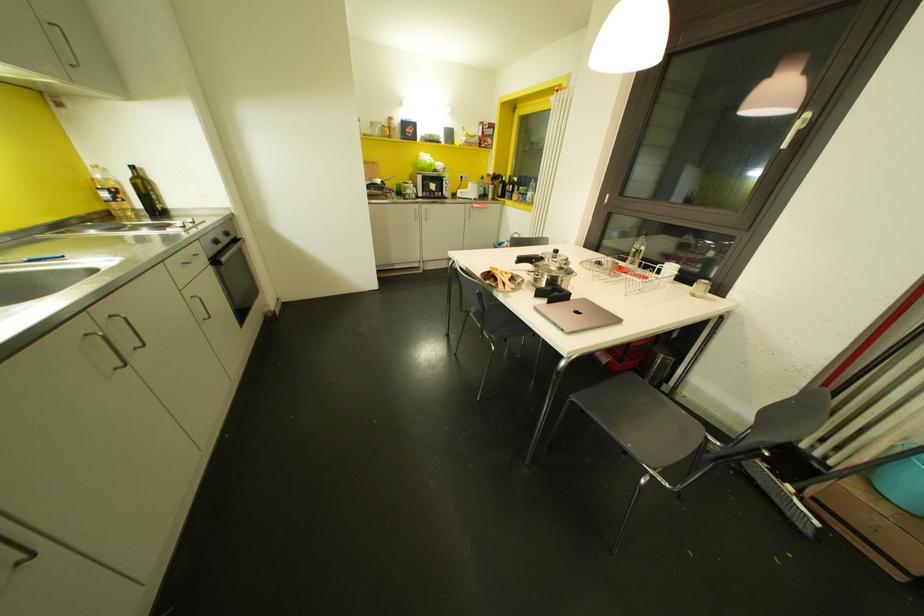
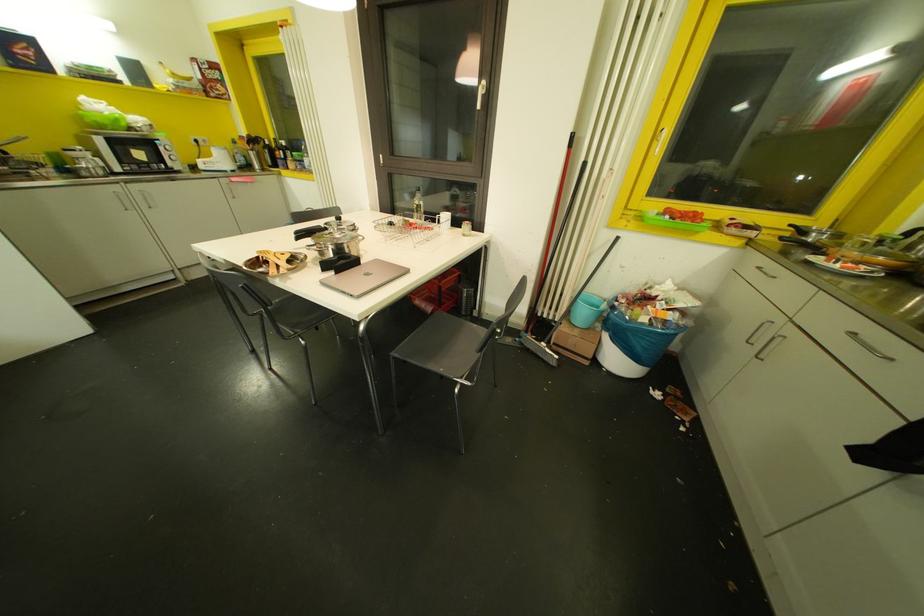
Question: Based on the continuous images, in which direction is the camera rotating? Reply with the corresponding letter.

Choices:
 (A) Left
 (B) Right
 (C) Up
 (D) Down

Answer: (B)